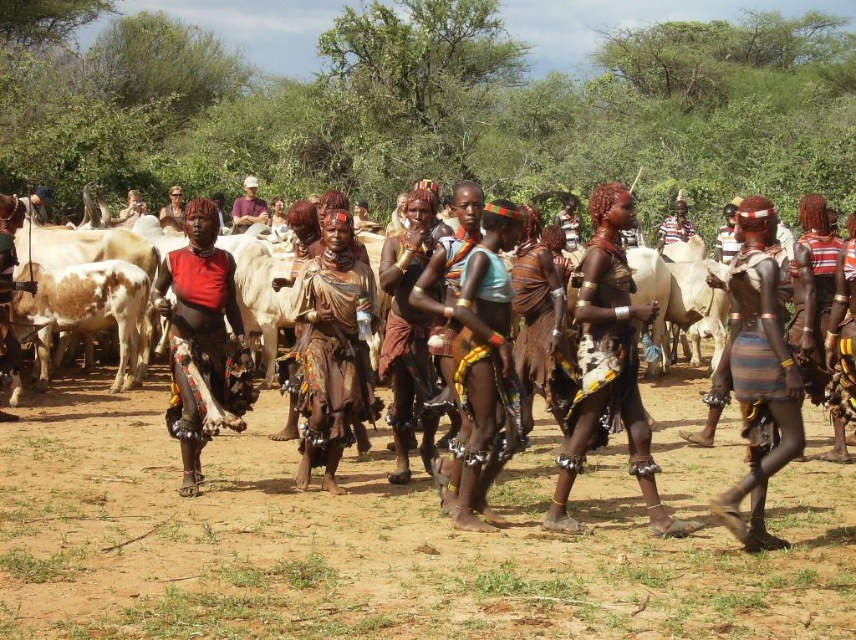
Is brown sandy ground at center below brown textured dress at center?

Correct, brown sandy ground at center is located below brown textured dress at center.

Can you confirm if brown sandy ground at center is smaller than brown textured dress at center?

Incorrect, brown sandy ground at center is not smaller in size than brown textured dress at center.

Where is `brown sandy ground at center`? brown sandy ground at center is located at coordinates (378, 545).

You are a GUI agent. You are given a task and a screenshot of the screen. Output one action in this format:
    pyautogui.click(x=<x>, y=<y>)
    Task: Click on the brown sandy ground at center
    
    Given the screenshot: What is the action you would take?
    pyautogui.click(x=378, y=545)

Is brown sandy ground at center above striped fabric skirt at center?

Incorrect, brown sandy ground at center is not positioned above striped fabric skirt at center.

Can you confirm if brown sandy ground at center is wider than striped fabric skirt at center?

Yes.

Is point (49, 573) less distant than point (739, 260)?

Yes, point (49, 573) is in front of point (739, 260).

Find the location of a particular element. brown sandy ground at center is located at coordinates (378, 545).

Does brown textured dress at center lie behind striped fabric skirt at right?

No.

Does point (349, 268) come closer to viewer compared to point (834, 253)?

Yes, it is.

Does point (361, 419) lie behind point (798, 321)?

No, it is in front of (798, 321).

The image size is (856, 640). I want to click on brown textured dress at center, so click(331, 348).